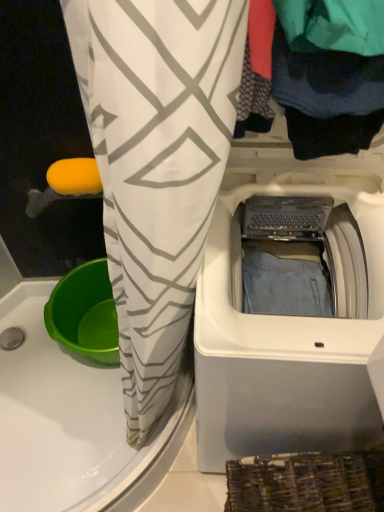
Question: Visually, is white plastic washing machine at upper right positioned to the left or to the right of dark blue fabric at upper right?

Choices:
 (A) left
 (B) right

Answer: (A)

Question: In terms of height, does white plastic washing machine at upper right look taller or shorter compared to dark blue fabric at upper right?

Choices:
 (A) short
 (B) tall

Answer: (B)

Question: From the image's perspective, is white plastic washing machine at upper right located above or below dark blue fabric at upper right?

Choices:
 (A) below
 (B) above

Answer: (A)

Question: Looking at the image, does dark blue fabric at upper right seem bigger or smaller compared to white plastic washing machine at upper right?

Choices:
 (A) big
 (B) small

Answer: (B)

Question: Relative to white plastic washing machine at upper right, is dark blue fabric at upper right in front or behind?

Choices:
 (A) behind
 (B) front

Answer: (B)

Question: Is dark blue fabric at upper right situated inside white plastic washing machine at upper right or outside?

Choices:
 (A) outside
 (B) inside

Answer: (A)

Question: Is dark blue fabric at upper right taller or shorter than white plastic washing machine at upper right?

Choices:
 (A) tall
 (B) short

Answer: (B)